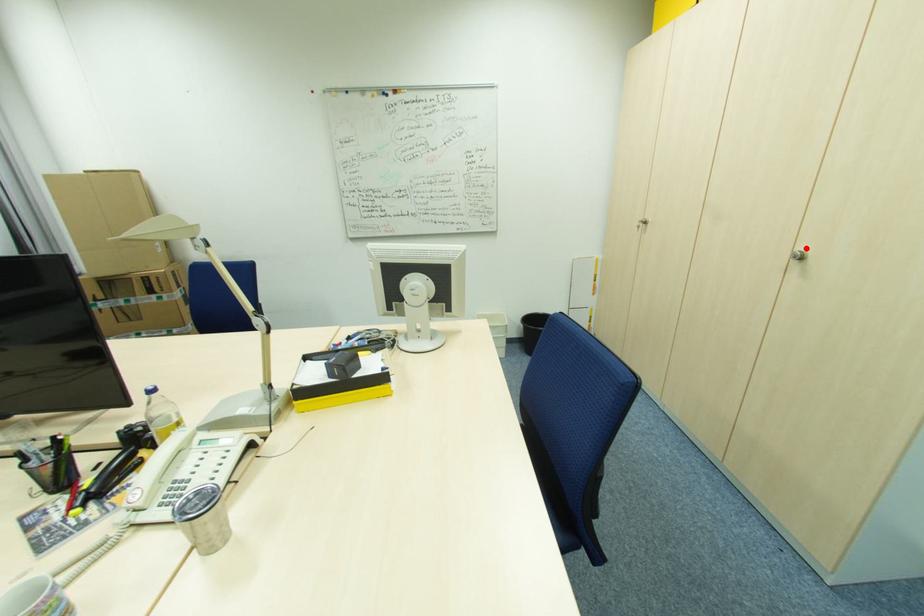
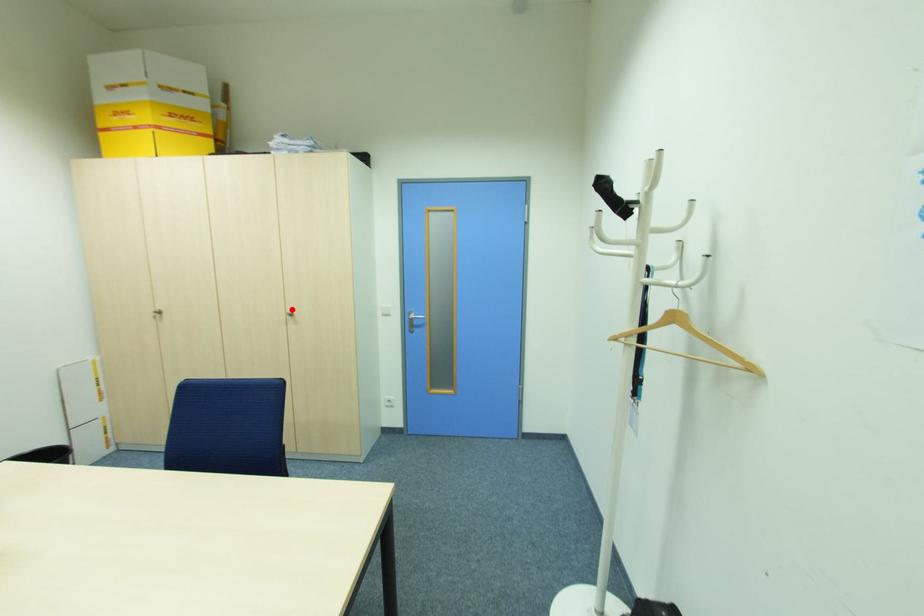
I am providing you with two images of the same scene from different viewpoints. A red point is marked on the first image and another point is marked on the second image. Does the point marked in image1 correspond to the same location as the one in image2?

Yes